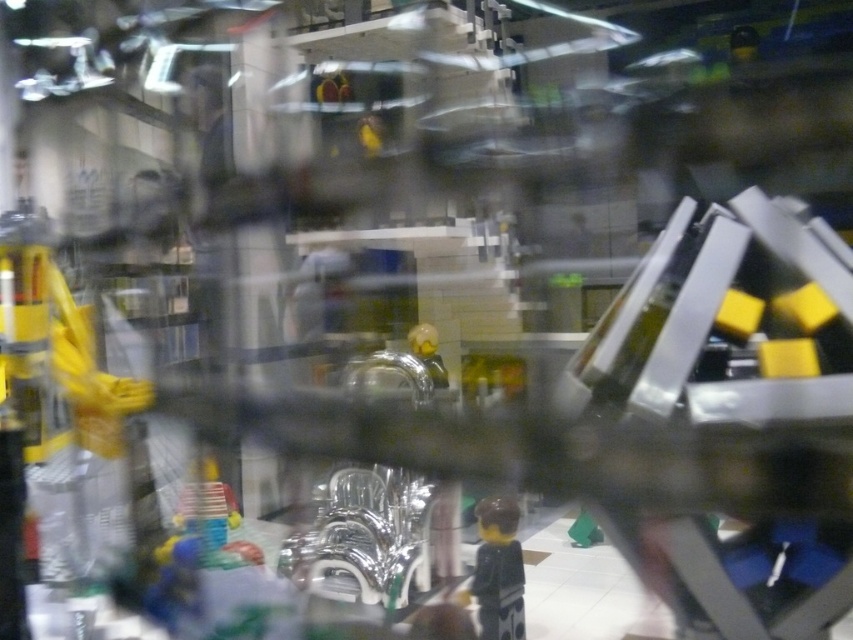
What are the coordinates of the smooth black minifigure at center in the image?

The smooth black minifigure at center is located at coordinates point (498, 570).

Looking at the scene through the glass, you see a smooth black minifigure at center and a yellow matte toy at center. Which one is positioned to the right side?

The smooth black minifigure at center is to the right of the yellow matte toy at center.